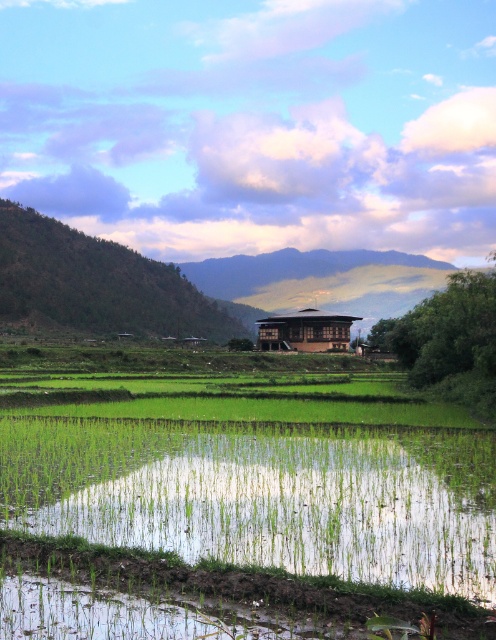
Does green grassy field at center appear on the left side of brown wooden hut at center?

Indeed, green grassy field at center is positioned on the left side of brown wooden hut at center.

Between green grassy field at center and brown wooden hut at center, which one is positioned higher?

brown wooden hut at center

Identify the location of green grassy field at center. (232, 496).

The width and height of the screenshot is (496, 640). What are the coordinates of `green grassy field at center` in the screenshot? It's located at (232, 496).